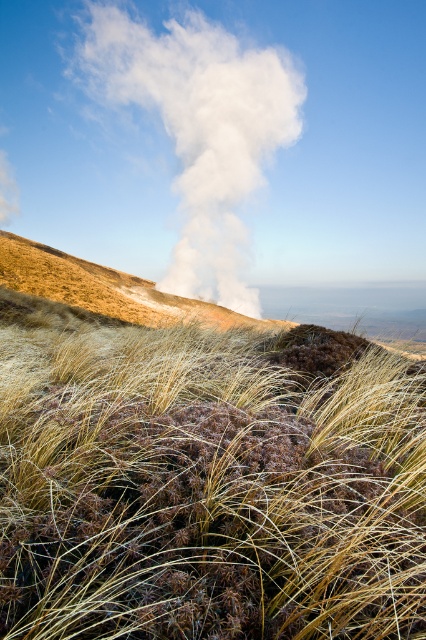
You are standing in the landscape and see both the dry grass at center and the white smoke at upper center. Which object is positioned to the right of the other?

The dry grass at center is to the right of white smoke at upper center.

You are standing in the middle of the scene and see the dry grass at center and the brown grassy hillside at center. Which object is closer to your feet?

The dry grass at center is closer to your feet because it is located below the brown grassy hillside at center.